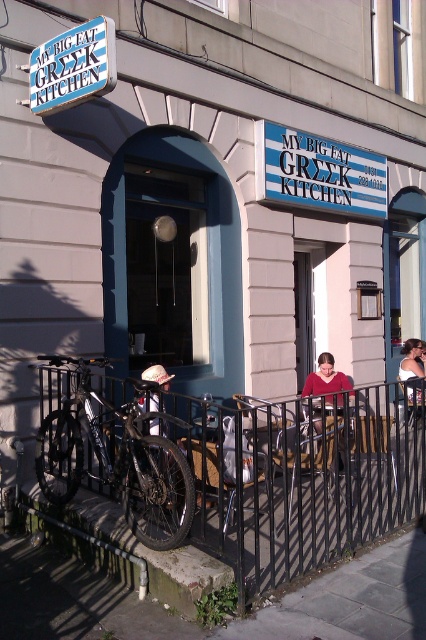
You are a delivery person who needs to reach the entrance of My Big Fat Greek Kitchen. You see a silver metallic bicycle at lower left and a matte red sweater at center. Which object is closer to the entrance?

The silver metallic bicycle at lower left is positioned under the matte red sweater at center, meaning it is closer to the entrance than the sweater.

You are standing in front of the restaurant and want to take a photo of both the silver metallic bicycle at lower left and the matte red sweater at center. Which object should you focus on first to ensure both are in the frame?

You should focus on the silver metallic bicycle at lower left first because it is closer to you than the matte red sweater at center, so adjusting the camera to include it will also capture the sweater in the background.

You are a delivery person approaching the restaurant and need to place a package on the ground near the matte red sweater at center. Where should you place it relative to the concrete pavement at lower center?

The concrete pavement at lower center is in front of the matte red sweater at center, so you should place the package behind the concrete pavement at lower center to position it near the matte red sweater at center.